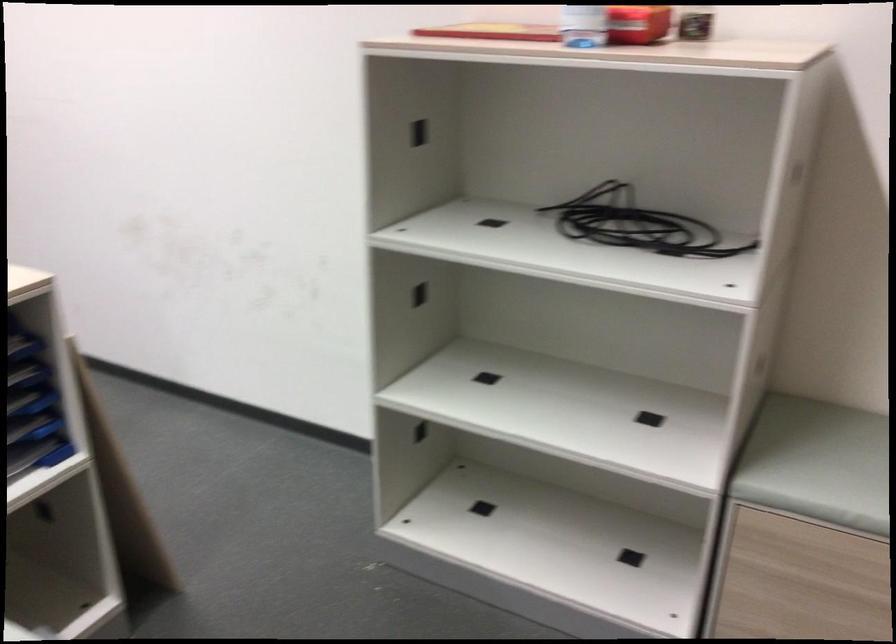
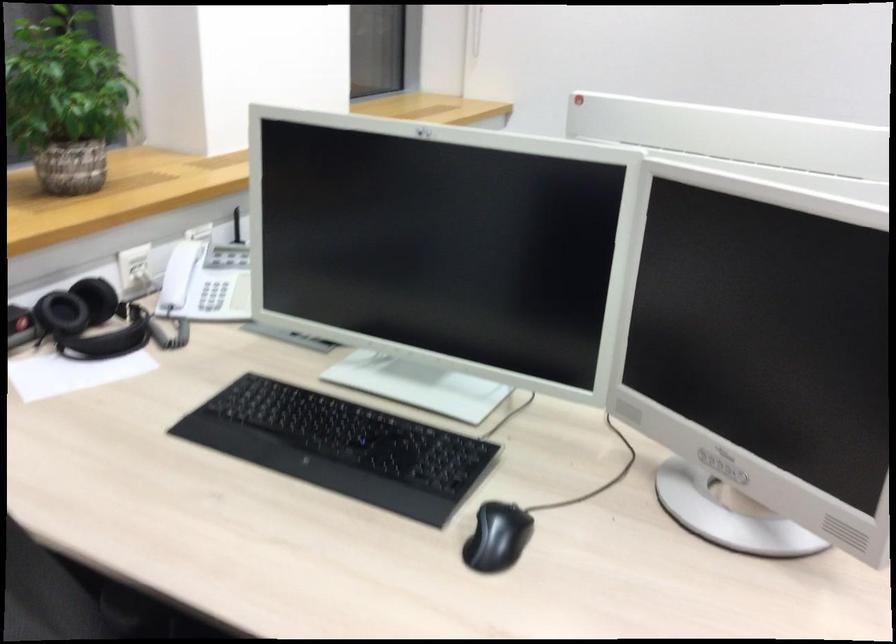
Question: The images are taken continuously from a first-person perspective. In which direction are you moving?

Choices:
 (A) Left
 (B) Right
 (C) Forward
 (D) Backward

Answer: (A)